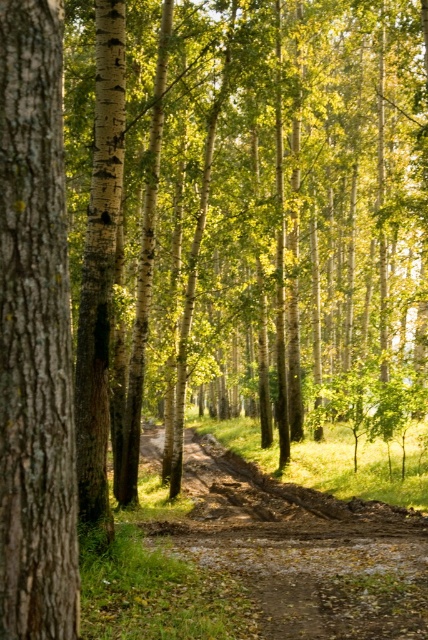
Question: Among these points, which one is farthest from the camera?

Choices:
 (A) (338, 579)
 (B) (11, 51)

Answer: (A)

Question: Does smooth brown bark at left appear under brown muddy path at center?

Choices:
 (A) yes
 (B) no

Answer: (B)

Question: Does smooth brown bark at left have a lesser width compared to brown muddy path at center?

Choices:
 (A) no
 (B) yes

Answer: (B)

Question: Can you confirm if smooth brown bark at left is positioned to the left of brown muddy path at center?

Choices:
 (A) no
 (B) yes

Answer: (B)

Question: Which point is closer to the camera?

Choices:
 (A) brown muddy path at center
 (B) smooth brown bark at left

Answer: (B)